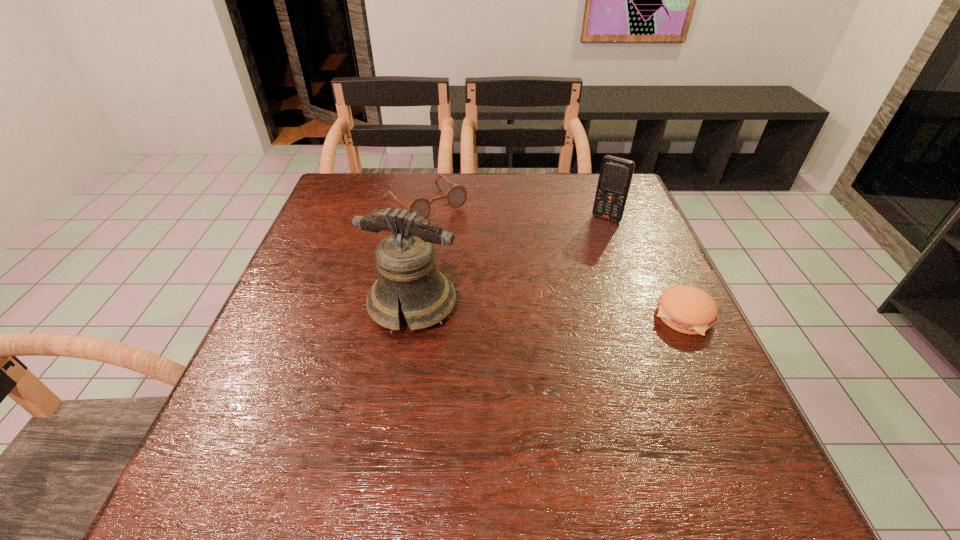
Locate an element on the screen. The height and width of the screenshot is (540, 960). bell is located at coordinates (407, 273).

In order to click on patty in this screenshot , I will do `click(687, 309)`.

This screenshot has width=960, height=540. What are the coordinates of `the third tallest object` in the screenshot? It's located at point(456,196).

Find the location of `cellular telephone`. cellular telephone is located at coordinates click(x=615, y=177).

Identify the location of free spot located on the left of the tallest object. This screenshot has height=540, width=960. (275, 305).

Find the location of a particular element. This screenshot has width=960, height=540. free region located on the back of the shortest object is located at coordinates (660, 265).

You are a GUI agent. You are given a task and a screenshot of the screen. Output one action in this format:
    pyautogui.click(x=<x>, y=<y>)
    Task: Click on the free spot located 0.250m on the front-facing side of the third tallest object
    Image resolution: width=960 pixels, height=540 pixels.
    Given the screenshot: What is the action you would take?
    pyautogui.click(x=501, y=271)

You are a GUI agent. You are given a task and a screenshot of the screen. Output one action in this format:
    pyautogui.click(x=<x>, y=<y>)
    Task: Click on the free region located 0.180m on the front-facing side of the third tallest object
    The width and height of the screenshot is (960, 540).
    Given the screenshot: What is the action you would take?
    pyautogui.click(x=485, y=255)

This screenshot has height=540, width=960. What are the coordinates of `vacant space located on the front-facing side of the third tallest object` in the screenshot? It's located at (498, 269).

You are a GUI agent. You are given a task and a screenshot of the screen. Output one action in this format:
    pyautogui.click(x=<x>, y=<y>)
    Task: Click on the vacant point located 0.260m on the screen of the cellular telephone
    This screenshot has width=960, height=540.
    Given the screenshot: What is the action you would take?
    pyautogui.click(x=563, y=279)